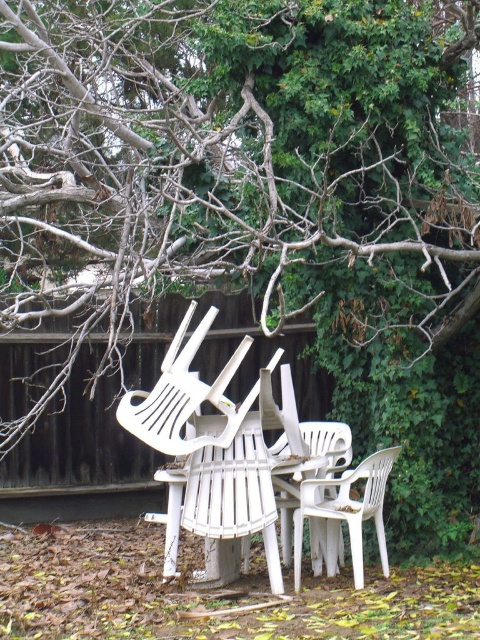
Question: Among these points, which one is farthest from the camera?

Choices:
 (A) (312, 472)
 (B) (226, 10)

Answer: (A)

Question: Which of the following is the farthest from the observer?

Choices:
 (A) (328, 493)
 (B) (7, 438)

Answer: (A)

Question: Based on their relative distances, which object is farther from the white plastic chair at center?

Choices:
 (A) white plastic chair at lower right
 (B) brown bark tree at center

Answer: (B)

Question: Is white plastic chair at lower right bigger than white plastic chair at center?

Choices:
 (A) yes
 (B) no

Answer: (B)

Question: Is white plastic chair at lower right closer to the viewer compared to white plastic chair at center?

Choices:
 (A) yes
 (B) no

Answer: (A)

Question: Does white plastic chair at lower right have a lesser width compared to white plastic chair at center?

Choices:
 (A) no
 (B) yes

Answer: (B)